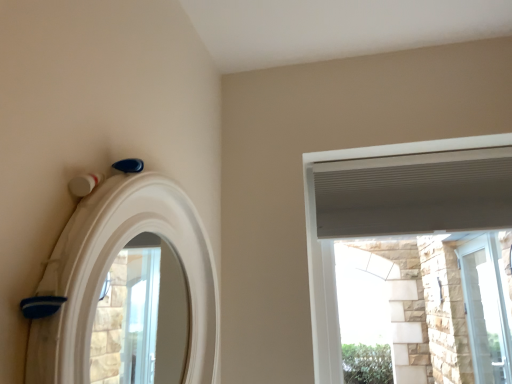
Question: Considering the relative sizes of white textured window at upper right, which appears as the 2th window when viewed from the right, and clear glass door at right, acting as the second window starting from the front, in the image provided, is white textured window at upper right, which appears as the 2th window when viewed from the right, shorter than clear glass door at right, acting as the second window starting from the front,?

Choices:
 (A) no
 (B) yes

Answer: (B)

Question: Considering the relative sizes of white textured window at upper right, the 1th window positioned from the front, and clear glass door at right, the first window from the right, in the image provided, is white textured window at upper right, the 1th window positioned from the front, smaller than clear glass door at right, the first window from the right,?

Choices:
 (A) yes
 (B) no

Answer: (B)

Question: Can you confirm if white textured window at upper right, marked as the first window in a left-to-right arrangement, is wider than clear glass door at right, the first window from the right?

Choices:
 (A) no
 (B) yes

Answer: (B)

Question: Is white textured window at upper right, acting as the second window starting from the bottom, aimed at clear glass door at right, the 1th window in the back-to-front sequence?

Choices:
 (A) yes
 (B) no

Answer: (B)

Question: Can you confirm if white textured window at upper right, which appears as the 2th window when viewed from the right, is bigger than clear glass door at right, the first window from the right?

Choices:
 (A) yes
 (B) no

Answer: (A)

Question: Considering the positions of point (486, 357) and point (366, 185), is point (486, 357) closer or farther from the camera than point (366, 185)?

Choices:
 (A) closer
 (B) farther

Answer: (B)

Question: Visually, is clear glass door at right, the first window from the right, positioned to the left or to the right of white textured window at upper right, marked as the first window in a left-to-right arrangement?

Choices:
 (A) left
 (B) right

Answer: (B)

Question: From a real-world perspective, relative to white textured window at upper right, arranged as the 2th window when viewed from the back, is clear glass door at right, acting as the second window starting from the front, vertically above or below?

Choices:
 (A) below
 (B) above

Answer: (A)

Question: Considering the positions of clear glass door at right, the second window positioned from the top, and white textured window at upper right, marked as the 1th window in a top-to-bottom arrangement, in the image, is clear glass door at right, the second window positioned from the top, taller or shorter than white textured window at upper right, marked as the 1th window in a top-to-bottom arrangement,?

Choices:
 (A) short
 (B) tall

Answer: (B)

Question: From a real-world perspective, is clear glass door at right, placed as the 2th window when sorted from left to right, positioned above or below white matte archway at upper left?

Choices:
 (A) below
 (B) above

Answer: (A)

Question: In terms of size, does clear glass door at right, acting as the second window starting from the front, appear bigger or smaller than white matte archway at upper left?

Choices:
 (A) big
 (B) small

Answer: (B)

Question: Considering the positions of point (490, 332) and point (76, 367), is point (490, 332) closer or farther from the camera than point (76, 367)?

Choices:
 (A) farther
 (B) closer

Answer: (A)

Question: Considering the positions of clear glass door at right, acting as the second window starting from the front, and white matte archway at upper left in the image, is clear glass door at right, acting as the second window starting from the front, wider or thinner than white matte archway at upper left?

Choices:
 (A) wide
 (B) thin

Answer: (B)

Question: Is white textured window at upper right, marked as the first window in a left-to-right arrangement, bigger or smaller than white matte archway at upper left?

Choices:
 (A) big
 (B) small

Answer: (A)

Question: From a real-world perspective, relative to white matte archway at upper left, is white textured window at upper right, marked as the 1th window in a top-to-bottom arrangement, vertically above or below?

Choices:
 (A) above
 (B) below

Answer: (A)